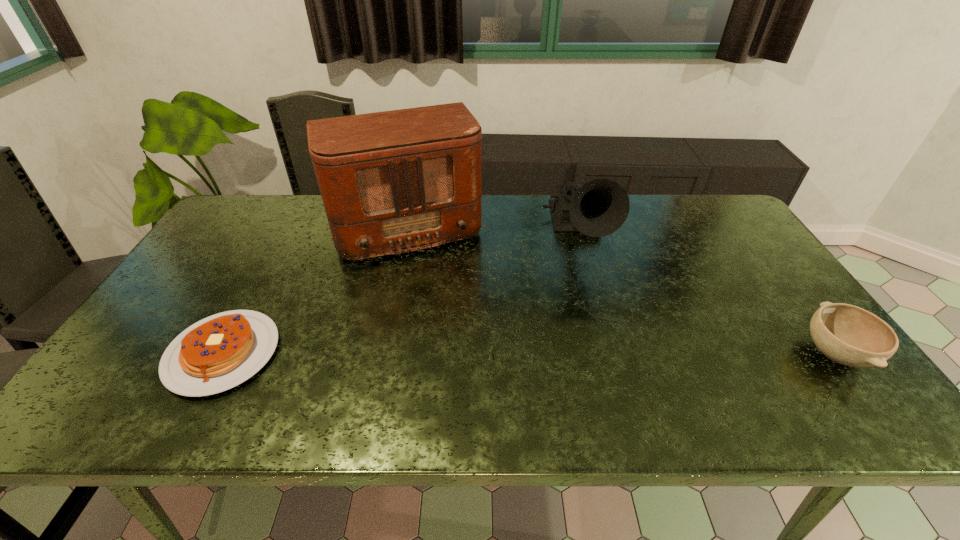
This screenshot has width=960, height=540. I want to click on free space between the bowl and the second tallest object, so click(x=707, y=294).

Locate an element on the screen. The image size is (960, 540). free space between the phonograph_record and the bowl is located at coordinates (707, 294).

At what (x,y) coordinates should I click in order to perform the action: click on unoccupied area between the shortest object and the rightmost object. Please return your answer as a coordinate pair (x, y). This screenshot has width=960, height=540. Looking at the image, I should click on [529, 353].

At what (x,y) coordinates should I click in order to perform the action: click on unoccupied area between the third object from left to right and the shortest object. Please return your answer as a coordinate pair (x, y). The height and width of the screenshot is (540, 960). Looking at the image, I should click on pyautogui.click(x=401, y=294).

Image resolution: width=960 pixels, height=540 pixels. I want to click on empty location between the radio receiver and the bowl, so click(x=618, y=291).

The height and width of the screenshot is (540, 960). Identify the location of free spot between the bowl and the phonograph_record. (707, 294).

Where is `free space between the pancake and the third shortest object`? This screenshot has height=540, width=960. free space between the pancake and the third shortest object is located at coordinates (401, 294).

Locate which object is the closest to the pancake. Please provide its 2D coordinates. Your answer should be formatted as a tuple, i.e. [(x, y)], where the tuple contains the x and y coordinates of a point satisfying the conditions above.

[(391, 182)]

Select which object is the third closest to the radio receiver. Please provide its 2D coordinates. Your answer should be formatted as a tuple, i.e. [(x, y)], where the tuple contains the x and y coordinates of a point satisfying the conditions above.

[(846, 334)]

Where is `vacant space that satisfies the following two spatial constraints: 1. on the front side of the rightmost object; 2. on the left side of the tallest object`? vacant space that satisfies the following two spatial constraints: 1. on the front side of the rightmost object; 2. on the left side of the tallest object is located at coordinates (374, 353).